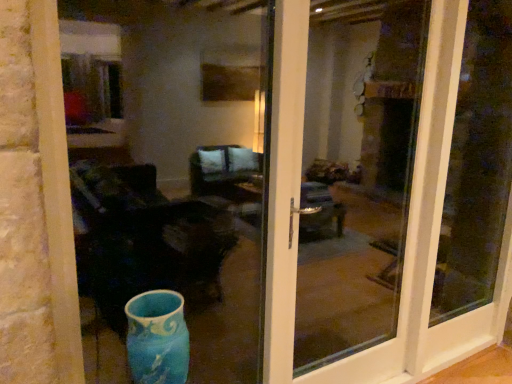
You are a GUI agent. You are given a task and a screenshot of the screen. Output one action in this format:
    pyautogui.click(x=<x>, y=<y>)
    Task: Click on the white glossy door at center
    The width and height of the screenshot is (512, 384).
    Given the screenshot: What is the action you would take?
    pyautogui.click(x=393, y=191)

What is the approximate width of white glossy door at center?

It is 9.64 centimeters.

In order to face white glossy door at center, should I rotate leftwards or rightwards?

To align with it, rotate right about 14.437°.

What do you see at coordinates (393, 191) in the screenshot? This screenshot has height=384, width=512. I see `white glossy door at center` at bounding box center [393, 191].

Find the location of a particular element. Image resolution: width=512 pixels, height=384 pixels. white glossy door at center is located at coordinates (393, 191).